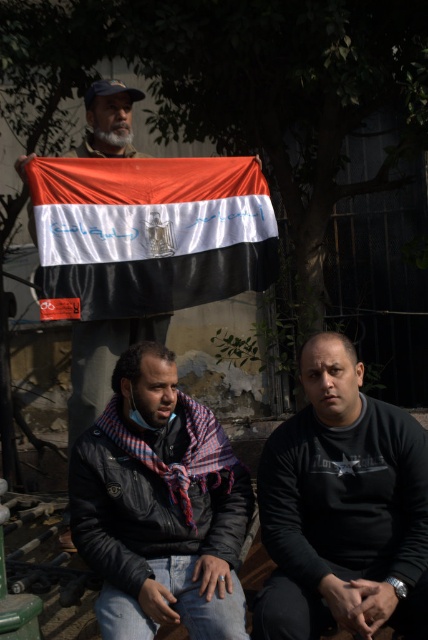
Question: Is black matte shirt at center to the right of matte fabric flag at upper center from the viewer's perspective?

Choices:
 (A) no
 (B) yes

Answer: (B)

Question: Which point is closer to the camera?

Choices:
 (A) black matte shirt at center
 (B) plaid scarf at center

Answer: (A)

Question: Does black matte shirt at center appear under matte fabric flag at upper center?

Choices:
 (A) no
 (B) yes

Answer: (B)

Question: Among these objects, which one is farthest from the camera?

Choices:
 (A) plaid scarf at center
 (B) matte fabric flag at upper center

Answer: (B)

Question: Which is nearer to the plaid scarf at center?

Choices:
 (A) matte fabric flag at upper center
 (B) matte black jacket at center
 (C) black matte shirt at center

Answer: (C)

Question: Does plaid scarf at center come in front of matte black jacket at center?

Choices:
 (A) yes
 (B) no

Answer: (A)